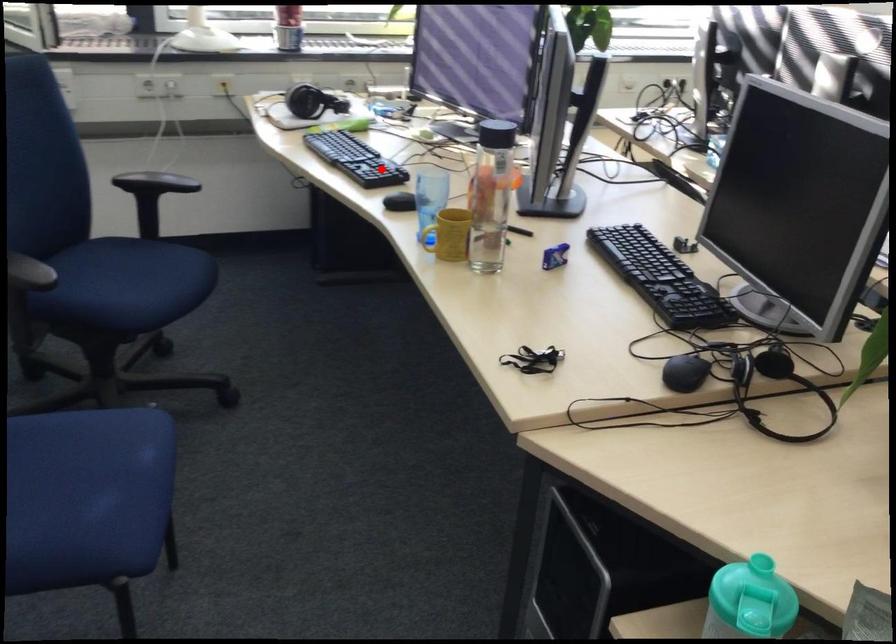
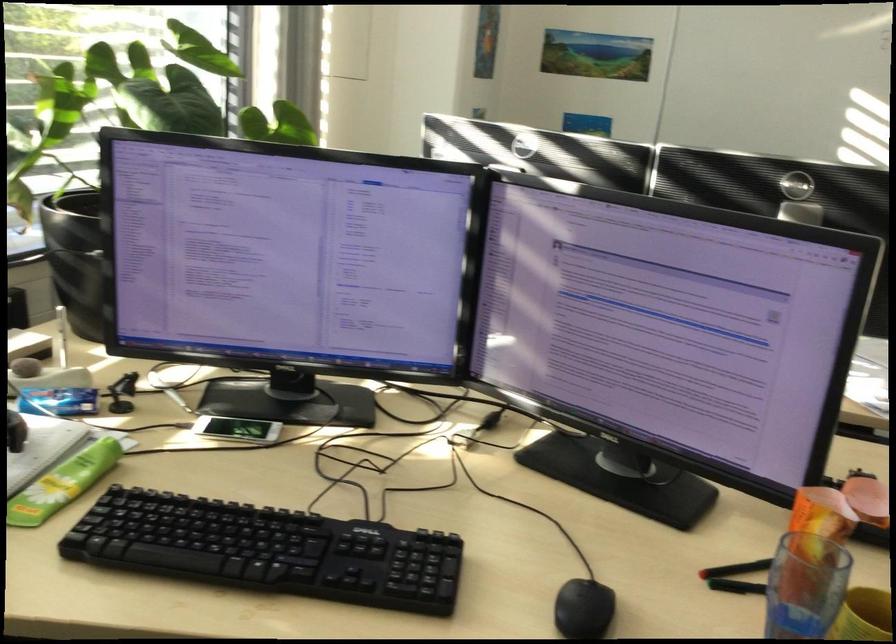
Where in the second image is the point corresponding to the highlighted location from the first image?

(424, 565)